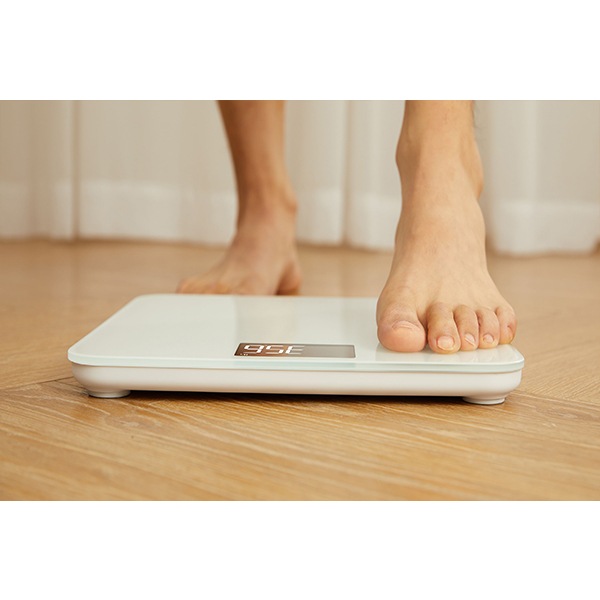
Locate an element on the screen. This screenshot has width=600, height=600. shadow of bathroom scale is located at coordinates (270, 401).